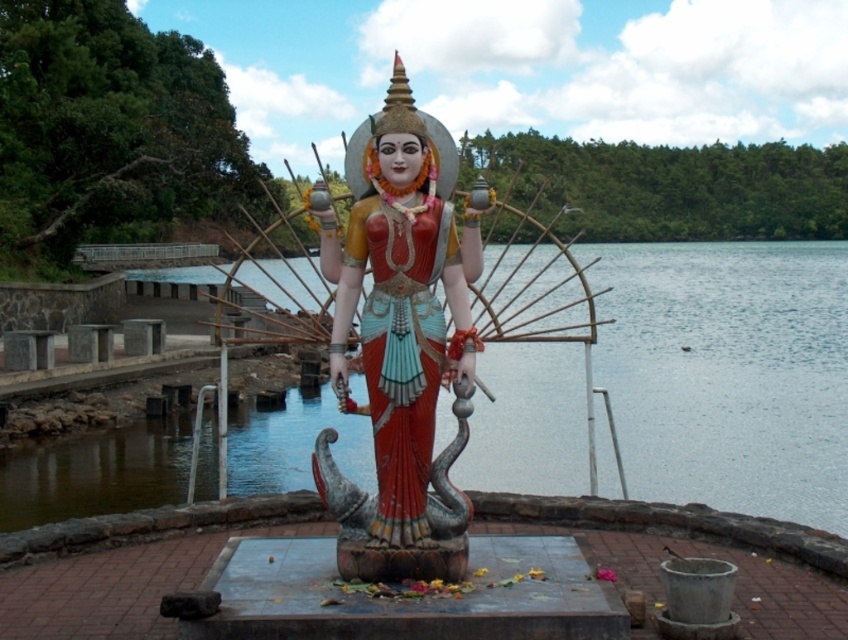
Question: Where is clear water at statue center located in relation to polished wood statue at center in the image?

Choices:
 (A) right
 (B) left

Answer: (B)

Question: Is clear water at statue center positioned before polished bronze statue at center?

Choices:
 (A) yes
 (B) no

Answer: (B)

Question: Which of the following is the closest to the observer?

Choices:
 (A) (375, 260)
 (B) (469, 317)
 (C) (701, 477)

Answer: (A)

Question: Is clear water at statue center positioned before polished bronze statue at center?

Choices:
 (A) no
 (B) yes

Answer: (A)

Question: Which of the following is the farthest from the observer?

Choices:
 (A) clear water at statue center
 (B) polished bronze statue at center

Answer: (A)

Question: Which of these objects is positioned closest to the polished bronze statue at center?

Choices:
 (A) polished wood statue at center
 (B) clear water at statue center

Answer: (A)